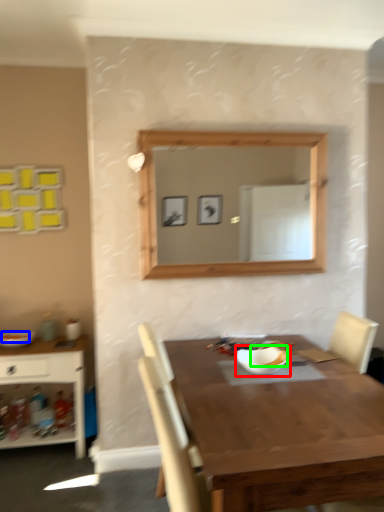
Question: Based on their relative distances, which object is nearer to bowl (highlighted by a red box)? Choose from food (highlighted by a blue box) and food (highlighted by a green box).

Choices:
 (A) food
 (B) food

Answer: (B)